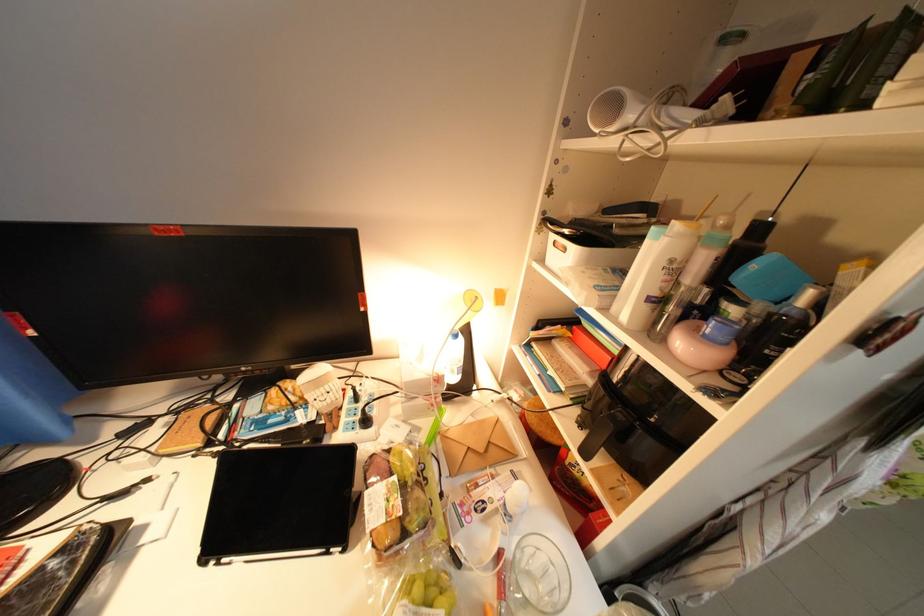
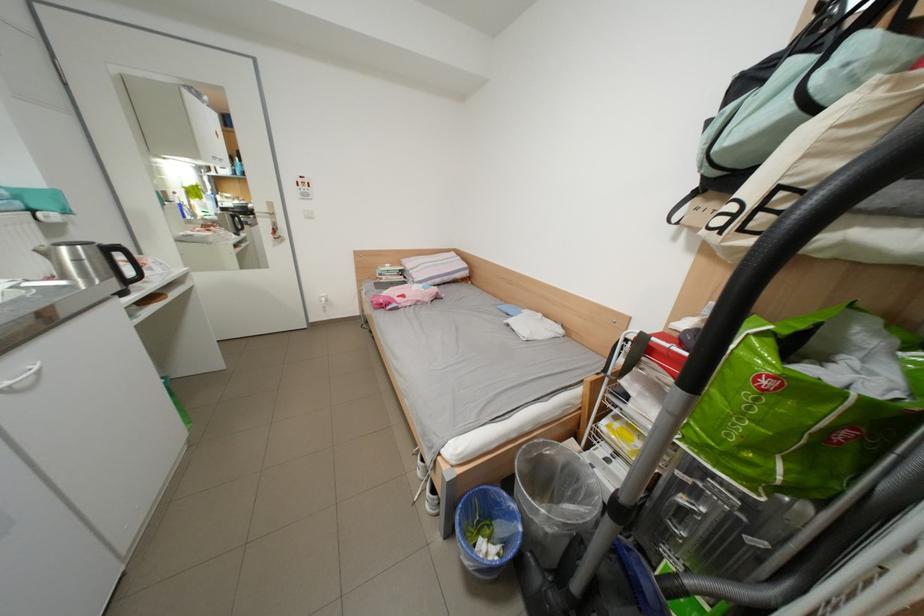
Looking at this image, the images are taken continuously from a first-person perspective. In which direction is your viewpoint rotating?

The camera's rotation is toward right-down.